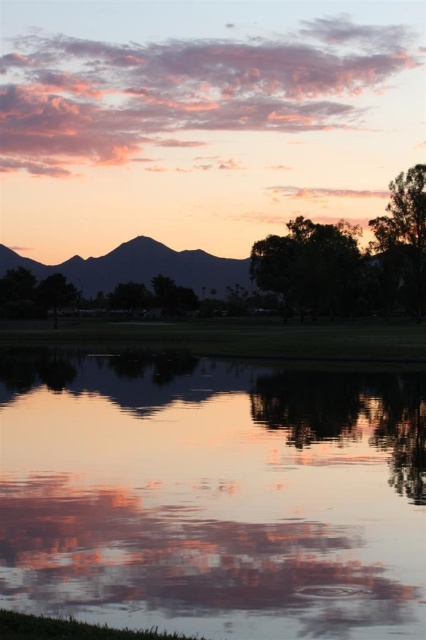
Question: From the image, what is the correct spatial relationship of silvery metallic mountain at center in relation to green leafy tree at right?

Choices:
 (A) above
 (B) below

Answer: (A)

Question: Does transparent water at center appear over silvery metallic mountain at center?

Choices:
 (A) yes
 (B) no

Answer: (B)

Question: Considering the real-world distances, which object is closest to the green matte tree at left?

Choices:
 (A) green leafy tree at upper right
 (B) silvery metallic mountain at center

Answer: (A)

Question: Is green leafy tree at right further to the viewer compared to green matte tree at left?

Choices:
 (A) yes
 (B) no

Answer: (A)

Question: Based on their relative distances, which object is farther from the green leafy tree at upper right?

Choices:
 (A) transparent water at center
 (B) green matte tree at left

Answer: (A)

Question: Which of the following is the closest to the observer?

Choices:
 (A) green matte tree at left
 (B) green leafy tree at center
 (C) green leafy tree at right

Answer: (A)